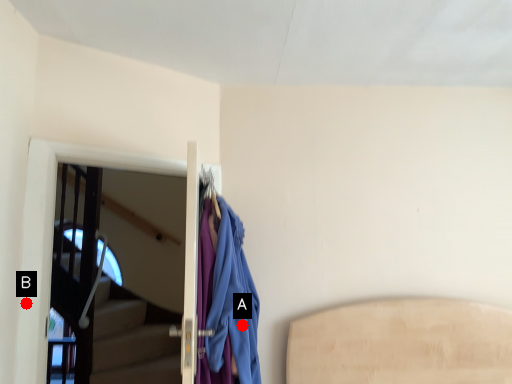
Question: Two points are circled on the image, labeled by A and B beside each circle. Which point is closer to the camera?

Choices:
 (A) A is closer
 (B) B is closer

Answer: (A)